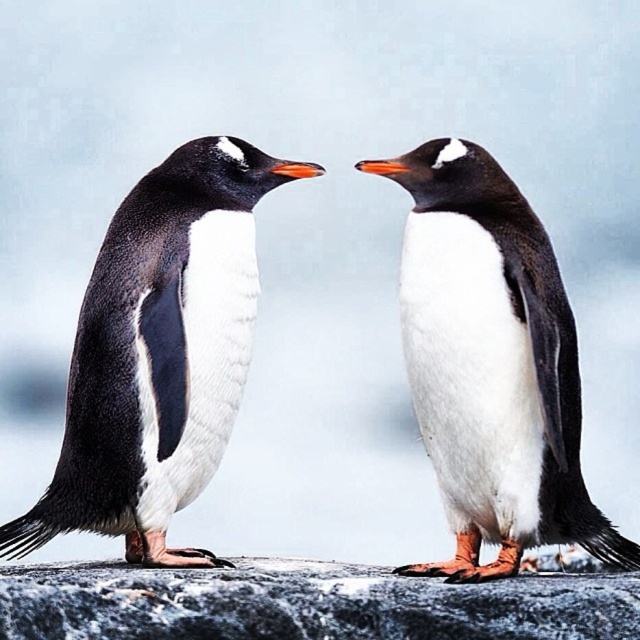
Question: Can you confirm if white matte penguin at center is wider than gray rough stone at center?

Choices:
 (A) yes
 (B) no

Answer: (B)

Question: Which object appears closest to the camera in this image?

Choices:
 (A) gray rough stone at center
 (B) black matte penguin at left
 (C) white matte penguin at center

Answer: (A)

Question: Does white matte penguin at center come behind gray rough stone at center?

Choices:
 (A) no
 (B) yes

Answer: (B)

Question: Which point appears closest to the camera in this image?

Choices:
 (A) (419, 228)
 (B) (163, 541)
 (C) (413, 618)

Answer: (C)

Question: Can you confirm if black matte penguin at left is smaller than gray rough stone at center?

Choices:
 (A) yes
 (B) no

Answer: (B)

Question: Which point appears closest to the camera in this image?

Choices:
 (A) (460, 536)
 (B) (145, 214)

Answer: (B)